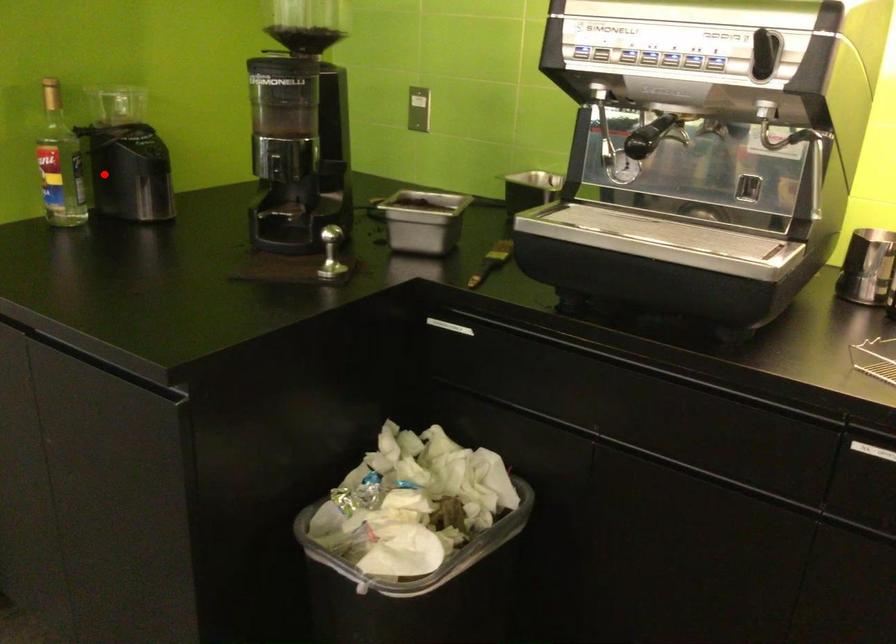
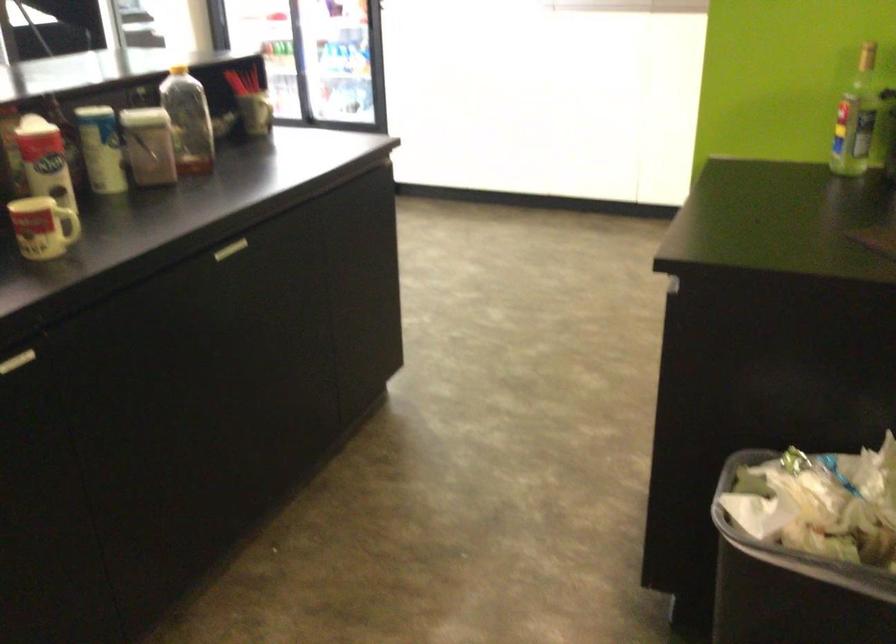
In the second image, find the point that corresponds to the highlighted location in the first image.

(856, 118)